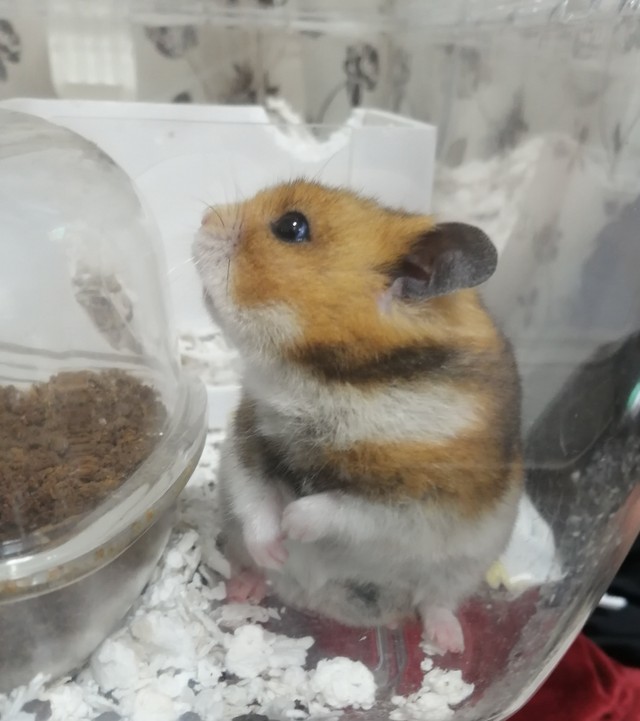
The height and width of the screenshot is (721, 640). In order to click on silver gray line on bowl rim in this screenshot , I will do `click(49, 552)`, `click(96, 528)`.